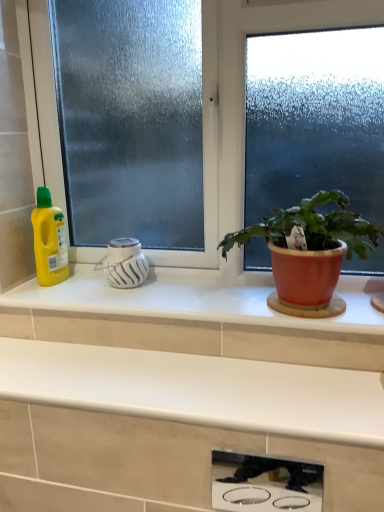
Question: In terms of size, does white glossy countertop at center, which is the 1th countertop in top-to-bottom order, appear bigger or smaller than white matte diffuser at center, which is the 2th appliance from front to back?

Choices:
 (A) big
 (B) small

Answer: (A)

Question: Visually, is white glossy countertop at center, acting as the second countertop starting from the bottom, positioned to the left or to the right of white matte diffuser at center, marked as the second appliance in a bottom-to-top arrangement?

Choices:
 (A) left
 (B) right

Answer: (B)

Question: Which is nearer to the matte terracotta pot at right?

Choices:
 (A) frosted glass window at center
 (B) stainless steel cooktop at lower center, the second appliance in the back-to-front sequence
 (C) yellow plastic bottle at left
 (D) white matte countertop at center, placed as the first countertop when sorted from bottom to top
 (E) white glossy countertop at center, which is the 1th countertop in top-to-bottom order

Answer: (E)

Question: Which is farther from the white matte countertop at center, which appears as the 2th countertop when viewed from the top?

Choices:
 (A) frosted glass window at center
 (B) white matte diffuser at center, which is the 2th appliance from front to back
 (C) stainless steel cooktop at lower center, placed as the second appliance when sorted from top to bottom
 (D) white glossy countertop at center, acting as the second countertop starting from the bottom
 (E) yellow plastic bottle at left

Answer: (C)